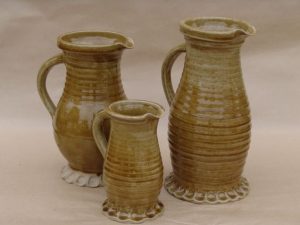
Where is `medium pitcher spout`? medium pitcher spout is located at coordinates (126, 43).